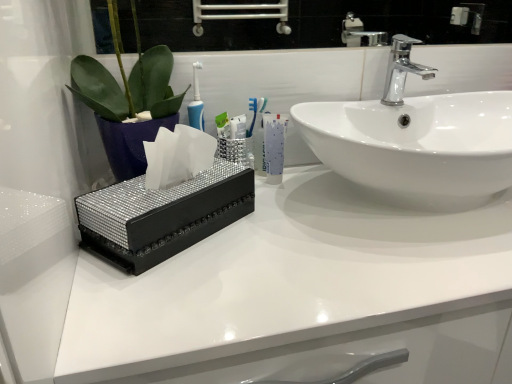
Question: Is black glossy tissue box at center taller or shorter than polished chrome faucet at upper right?

Choices:
 (A) tall
 (B) short

Answer: (A)

Question: Does point (489, 269) appear closer or farther from the camera than point (398, 102)?

Choices:
 (A) farther
 (B) closer

Answer: (B)

Question: Based on their relative distances, which object is farther from the black glossy tissue box at center?

Choices:
 (A) white glossy sink at center
 (B) sparkly black tissue box at center
 (C) white glossy mouthwash at center
 (D) polished chrome faucet at upper right

Answer: (D)

Question: Which object is positioned farthest from the black glossy tissue box at center?

Choices:
 (A) white glossy sink at center
 (B) white glossy mouthwash at center
 (C) polished chrome faucet at upper right
 (D) sparkly black tissue box at center

Answer: (C)